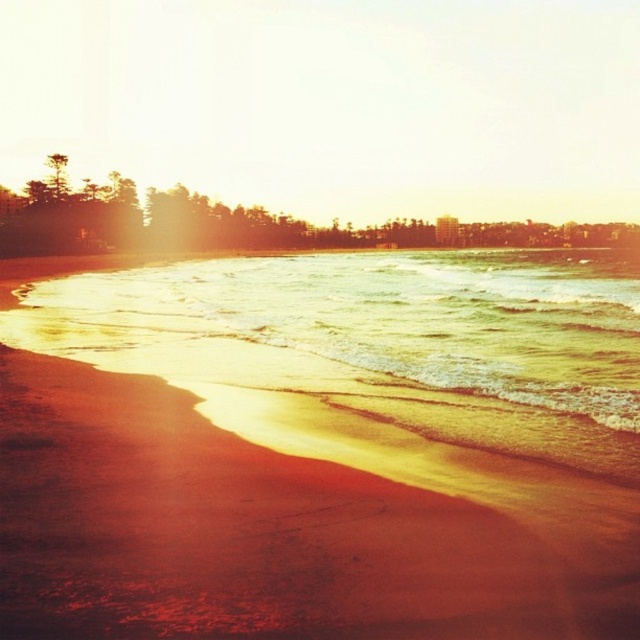
You are standing on the sandy beach at lower left and want to walk towards the sandy yellow water at lower left. Which area will you step into first?

The sandy beach at lower left occupies less space than the sandy yellow water at lower left, so you will step into the sandy yellow water at lower left first.

You are standing on the sandy beach at lower left and want to walk towards the sandy yellow water at lower left. Which direction should you move to reach the water?

Since the sandy beach at lower left has a lesser height compared to the sandy yellow water at lower left, you should move towards the lower elevation to reach the water.

You are standing on the sandy beach at lower left and want to reach the sandy yellow water at lower left. Which direction should you move to get closer to the water?

You should move forward towards the sandy yellow water at lower left because the sandy beach at lower left is closer to the viewer than the sandy yellow water at lower left, so moving forward from the beach towards the water will bring you closer.